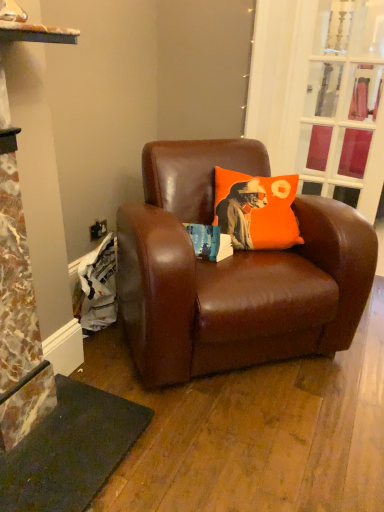
Question: Do you think orange fabric pillow at center is within brown leather chair at center, or outside of it?

Choices:
 (A) outside
 (B) inside

Answer: (B)

Question: From a real-world perspective, is orange fabric pillow at center above or below brown leather chair at center?

Choices:
 (A) below
 (B) above

Answer: (B)

Question: Which object is the farthest from the clear glass door at upper right?

Choices:
 (A) orange fabric pillow at center
 (B) brown leather chair at center

Answer: (B)

Question: Considering the real-world distances, which object is farthest from the clear glass door at upper right?

Choices:
 (A) brown leather chair at center
 (B) orange fabric pillow at center

Answer: (A)